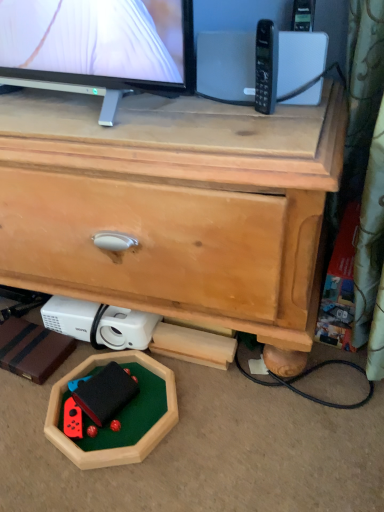
Question: Is point (82, 411) positioned closer to the camera than point (187, 268)?

Choices:
 (A) closer
 (B) farther

Answer: (B)

Question: From their relative heights in the image, would you say rubberized black toy at lower center is taller or shorter than wooden chest of drawers at center?

Choices:
 (A) tall
 (B) short

Answer: (B)

Question: Which is nearer to the rubberized black toy at lower center?

Choices:
 (A) white plastic projector at lower left
 (B) wooden chest of drawers at center
 (C) black plastic phone at upper right

Answer: (A)

Question: Estimate the real-world distances between objects in this image. Which object is closer to the wooden chest of drawers at center?

Choices:
 (A) white plastic projector at lower left
 (B) rubberized black toy at lower center
 (C) black plastic phone at upper right

Answer: (A)